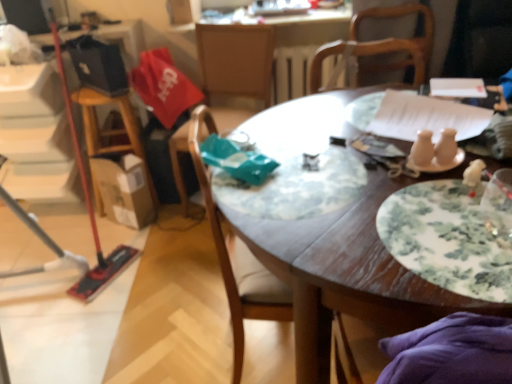
Question: Is floral-patterned ceramic plate at center-right oriented towards wooden table at center?

Choices:
 (A) yes
 (B) no

Answer: (A)

Question: Is floral-patterned ceramic plate at center-right oriented away from wooden table at center?

Choices:
 (A) no
 (B) yes

Answer: (B)

Question: Would you say floral-patterned ceramic plate at center-right is a long distance from wooden table at center?

Choices:
 (A) yes
 (B) no

Answer: (B)

Question: Can you confirm if floral-patterned ceramic plate at center-right is wider than wooden table at center?

Choices:
 (A) yes
 (B) no

Answer: (B)

Question: Is floral-patterned ceramic plate at center-right in front of wooden table at center?

Choices:
 (A) yes
 (B) no

Answer: (B)

Question: In terms of height, does wooden chair at center, the second chair positioned from the front, look taller or shorter compared to wooden table at center?

Choices:
 (A) short
 (B) tall

Answer: (B)

Question: Looking at their shapes, would you say wooden chair at center, positioned as the first chair in back-to-front order, is wider or thinner than wooden table at center?

Choices:
 (A) wide
 (B) thin

Answer: (B)

Question: Considering the positions of point (244, 94) and point (310, 360), is point (244, 94) closer or farther from the camera than point (310, 360)?

Choices:
 (A) closer
 (B) farther

Answer: (B)

Question: Considering the relative positions of wooden chair at center, the second chair positioned from the front, and wooden table at center in the image provided, is wooden chair at center, the second chair positioned from the front, to the left or to the right of wooden table at center?

Choices:
 (A) left
 (B) right

Answer: (A)

Question: Considering their positions, is wooden chair at center, the second chair positioned from the front, located in front of or behind floral-patterned ceramic plate at center-right?

Choices:
 (A) behind
 (B) front

Answer: (A)

Question: From a real-world perspective, is wooden chair at center, the second chair positioned from the front, above or below floral-patterned ceramic plate at center-right?

Choices:
 (A) below
 (B) above

Answer: (A)

Question: In terms of height, does wooden chair at center, positioned as the first chair in back-to-front order, look taller or shorter compared to floral-patterned ceramic plate at center-right?

Choices:
 (A) short
 (B) tall

Answer: (B)

Question: Considering the positions of wooden chair at center, the second chair positioned from the front, and floral-patterned ceramic plate at center-right in the image, is wooden chair at center, the second chair positioned from the front, bigger or smaller than floral-patterned ceramic plate at center-right?

Choices:
 (A) small
 (B) big

Answer: (B)

Question: Is wooden chair at center, the 2th chair when ordered from back to front, bigger or smaller than wooden table at center?

Choices:
 (A) small
 (B) big

Answer: (A)

Question: Would you say wooden chair at center, marked as the 1th chair in a front-to-back arrangement, is inside or outside wooden table at center?

Choices:
 (A) inside
 (B) outside

Answer: (A)